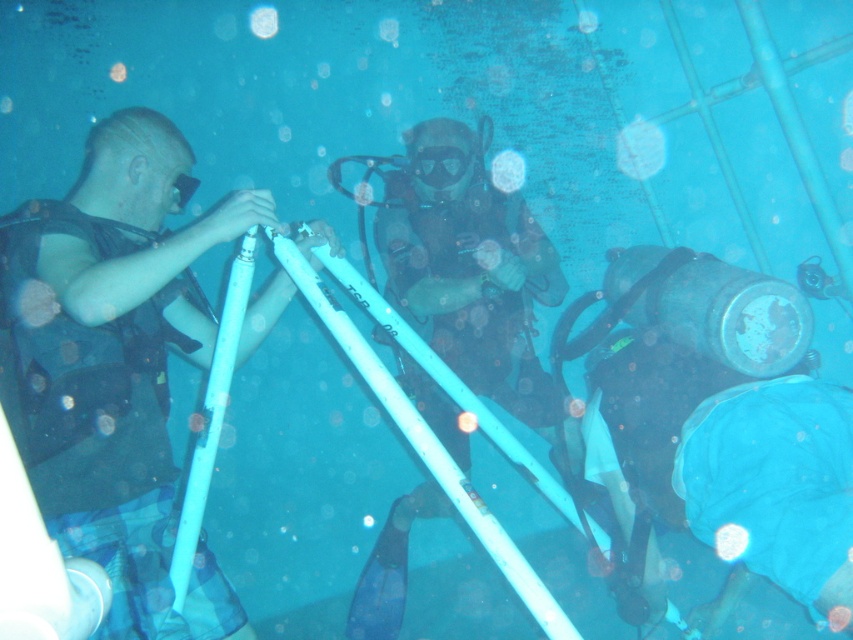
Does matte black vest at left appear on the left side of transparent rubber mask at center?

Indeed, matte black vest at left is positioned on the left side of transparent rubber mask at center.

This screenshot has width=853, height=640. What are the coordinates of `matte black vest at left` in the screenshot? It's located at (115, 364).

Is matte black vest at left in front of transparent plastic bubble at upper center?

Yes, it is in front of transparent plastic bubble at upper center.

How distant is matte black vest at left from transparent plastic bubble at upper center?

A distance of 5.77 feet exists between matte black vest at left and transparent plastic bubble at upper center.

This screenshot has width=853, height=640. I want to click on matte black vest at left, so click(x=115, y=364).

Can you confirm if transparent rubber mask at center is smaller than transparent plastic bubble at upper center?

No.

Which is above, transparent rubber mask at center or transparent plastic bubble at upper center?

transparent plastic bubble at upper center is higher up.

Measure the distance between point (x=421, y=170) and camera.

Point (x=421, y=170) is 2.62 meters from camera.

Image resolution: width=853 pixels, height=640 pixels. I want to click on transparent rubber mask at center, so click(438, 164).